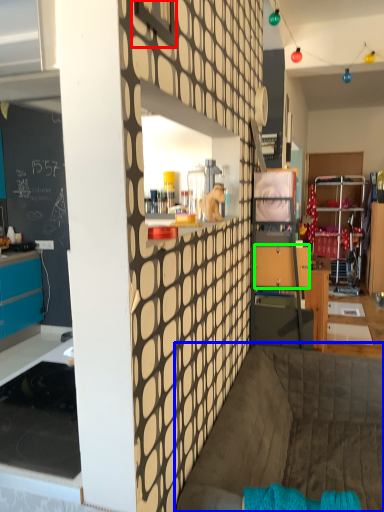
Question: Which object is positioned closest to window (highlighted by a red box)? Select from couch (highlighted by a blue box) and drawer (highlighted by a green box).

Choices:
 (A) couch
 (B) drawer

Answer: (A)